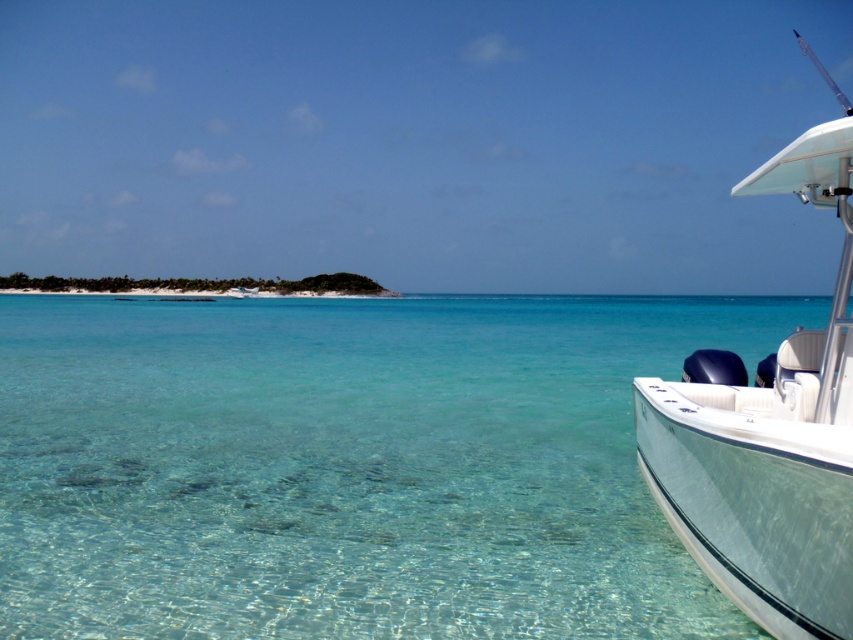
Question: Which object is farther from the camera taking this photo?

Choices:
 (A) clear glassy water at lower right
 (B) white glossy boat at right

Answer: (A)

Question: Which object is closer to the camera taking this photo?

Choices:
 (A) white glossy boat at right
 (B) clear glassy water at lower right

Answer: (A)

Question: Does clear glassy water at lower right have a lesser width compared to white glossy boat at right?

Choices:
 (A) no
 (B) yes

Answer: (B)

Question: Can you confirm if clear glassy water at lower right is positioned to the right of white glossy boat at right?

Choices:
 (A) no
 (B) yes

Answer: (A)

Question: Is clear glassy water at lower right wider than white glossy boat at right?

Choices:
 (A) no
 (B) yes

Answer: (A)

Question: Which of the following is the closest to the observer?

Choices:
 (A) white glossy boat at right
 (B) clear glassy water at lower right

Answer: (A)